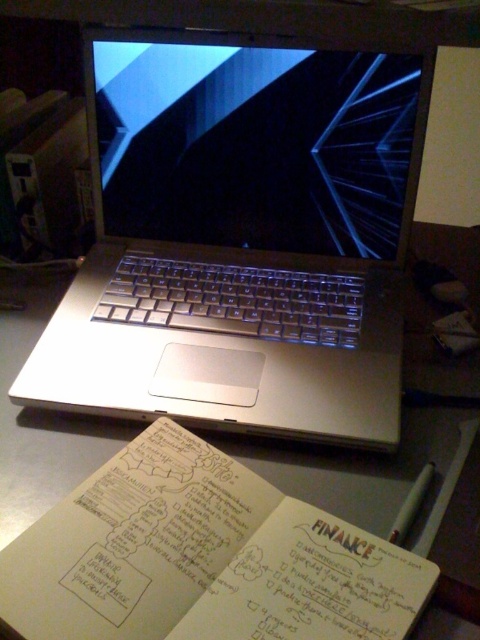
Question: Does satin black screen at center appear under metallic table at center?

Choices:
 (A) no
 (B) yes

Answer: (A)

Question: Does satin black screen at center lie behind white paper notebook at lower left?

Choices:
 (A) no
 (B) yes

Answer: (B)

Question: Can you confirm if silver metallic laptop at center is positioned above satin black screen at center?

Choices:
 (A) no
 (B) yes

Answer: (A)

Question: Which is nearer to the satin black screen at center?

Choices:
 (A) metallic table at center
 (B) white paper notebook at lower left

Answer: (A)

Question: Which object appears closest to the camera in this image?

Choices:
 (A) silver metallic laptop at center
 (B) satin black screen at center

Answer: (A)

Question: Estimate the real-world distances between objects in this image. Which object is farther from the metallic table at center?

Choices:
 (A) satin black screen at center
 (B) silver metallic laptop at center

Answer: (A)